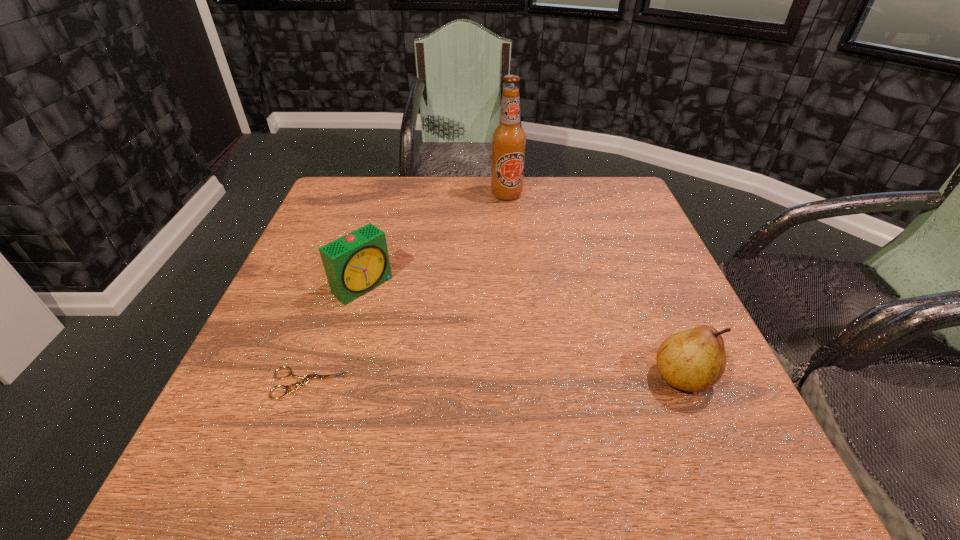
Where is `free space between the shortest object and the second farthest object`? The height and width of the screenshot is (540, 960). free space between the shortest object and the second farthest object is located at coordinates (336, 335).

You are a GUI agent. You are given a task and a screenshot of the screen. Output one action in this format:
    pyautogui.click(x=<x>, y=<y>)
    Task: Click on the vacant space that's between the farthest object and the pear
    
    Given the screenshot: What is the action you would take?
    pyautogui.click(x=594, y=286)

This screenshot has height=540, width=960. I want to click on free space between the beer bottle and the pear, so click(594, 286).

This screenshot has width=960, height=540. In order to click on empty location between the tallest object and the second farthest object in this screenshot , I will do `click(435, 240)`.

Where is `vacant point located between the beer bottle and the second farthest object`? vacant point located between the beer bottle and the second farthest object is located at coordinates (435, 240).

Where is `free area in between the beer bottle and the alarm clock`? Image resolution: width=960 pixels, height=540 pixels. free area in between the beer bottle and the alarm clock is located at coordinates (435, 240).

Identify the location of free space between the pear and the shortest object. This screenshot has width=960, height=540. (495, 380).

Where is `vacant space that is in between the third nearest object and the rightmost object`? The image size is (960, 540). vacant space that is in between the third nearest object and the rightmost object is located at coordinates (522, 332).

Locate an element on the screen. the closest object to the third object from left to right is located at coordinates (356, 263).

The width and height of the screenshot is (960, 540). What are the coordinates of `object that stands as the closest to the rightmost object` in the screenshot? It's located at (356, 263).